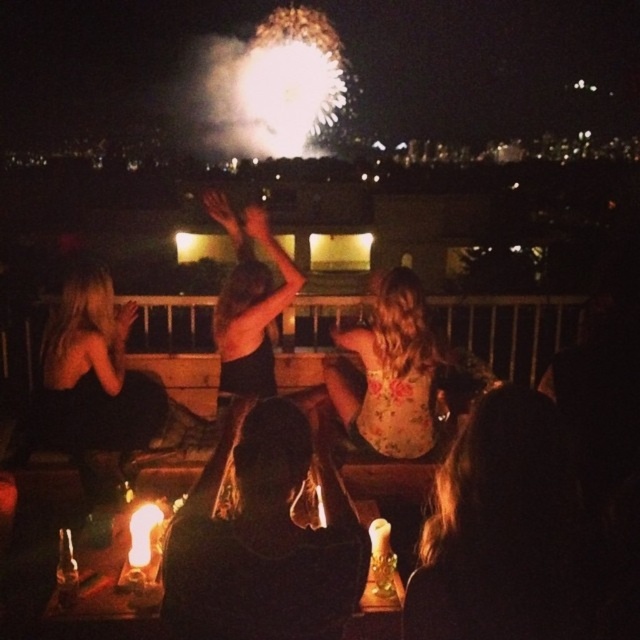
Question: Is black matte dress at center to the left of translucent glass candle at center from the viewer's perspective?

Choices:
 (A) yes
 (B) no

Answer: (B)

Question: Which point is farther from the camera taking this photo?

Choices:
 (A) (236, 541)
 (B) (60, 381)
 (C) (122, 560)

Answer: (B)

Question: Which point is farther from the camera taking this photo?

Choices:
 (A) (154, 401)
 (B) (388, 604)
 (C) (268, 563)

Answer: (A)

Question: Is matte black dress at left closer to camera compared to black matte dress at center?

Choices:
 (A) yes
 (B) no

Answer: (B)

Question: Can you confirm if matte black dress at center is smaller than black matte dress at center?

Choices:
 (A) yes
 (B) no

Answer: (A)

Question: Which point appears farthest from the camera in this image?

Choices:
 (A) (380, 392)
 (B) (38, 416)
 (C) (378, 600)
 (D) (268, 248)

Answer: (B)